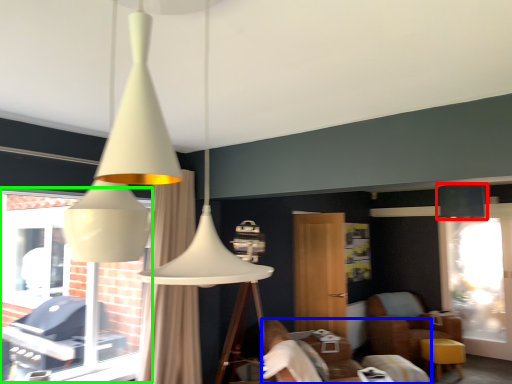
Question: Considering the real-world distances, which object is closest to lamp (highlighted by a red box)? furniture (highlighted by a blue box) or bay window (highlighted by a green box).

Choices:
 (A) furniture
 (B) bay window

Answer: (A)